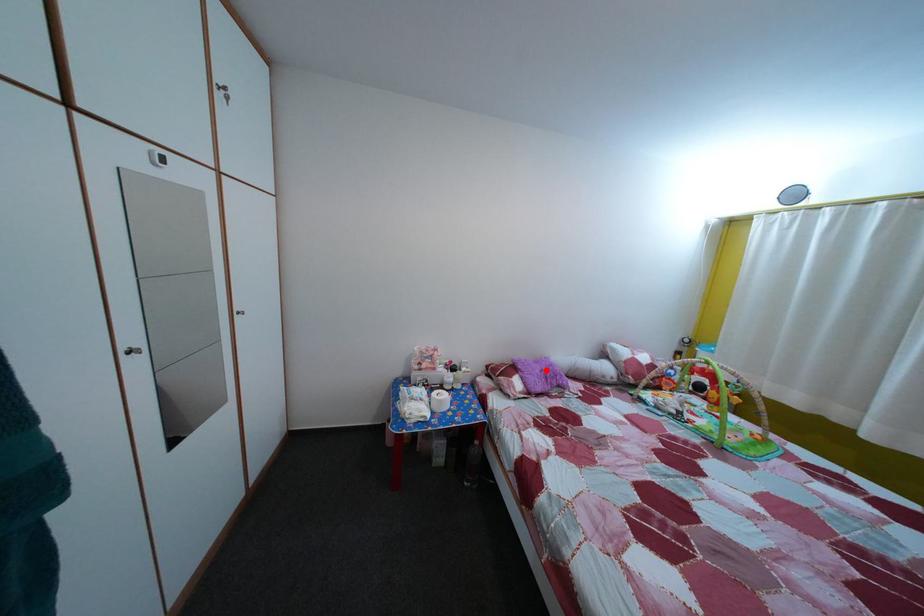
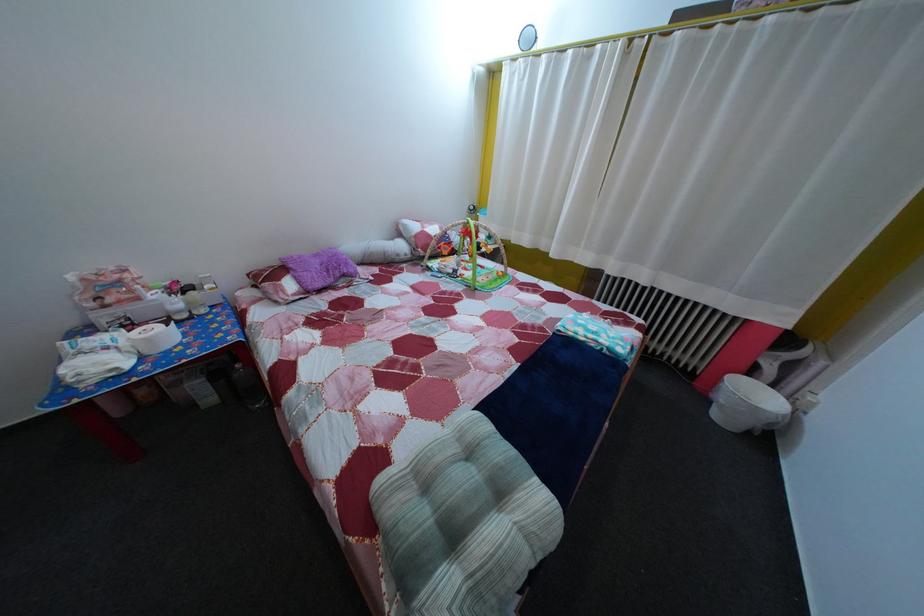
Question: A red point is marked in image1. In image2, is the corresponding 3D point closer to the camera or farther? Reply with the corresponding letter.

Choices:
 (A) The corresponding 3D point is closer.
 (B) The corresponding 3D point is farther.

Answer: (A)